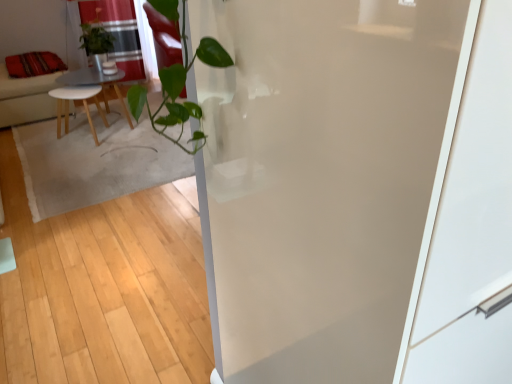
Question: In the image, is wooden table at center on the left side or the right side of red sheer curtain at upper left?

Choices:
 (A) left
 (B) right

Answer: (B)

Question: Considering the positions of wooden table at center and red sheer curtain at upper left in the image, is wooden table at center bigger or smaller than red sheer curtain at upper left?

Choices:
 (A) small
 (B) big

Answer: (B)

Question: Based on their relative distances, which object is nearer to the red sheer curtain at upper left?

Choices:
 (A) wooden table at center
 (B) transparent glass screen door at center
 (C) red fabric cushion at left
 (D) velvet red pillow at upper left

Answer: (A)

Question: Which is nearer to the transparent glass screen door at center?

Choices:
 (A) red fabric cushion at left
 (B) wooden table at center
 (C) velvet red pillow at upper left
 (D) red sheer curtain at upper left

Answer: (B)